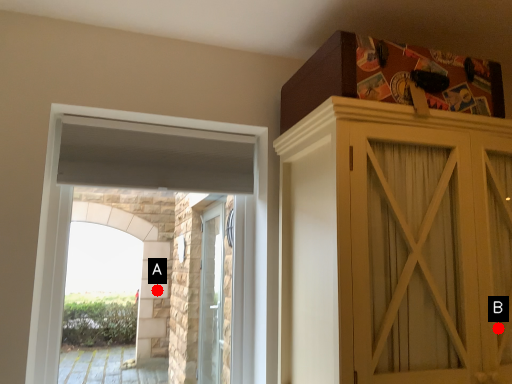
Question: Two points are circled on the image, labeled by A and B beside each circle. Which point is closer to the camera?

Choices:
 (A) A is closer
 (B) B is closer

Answer: (B)